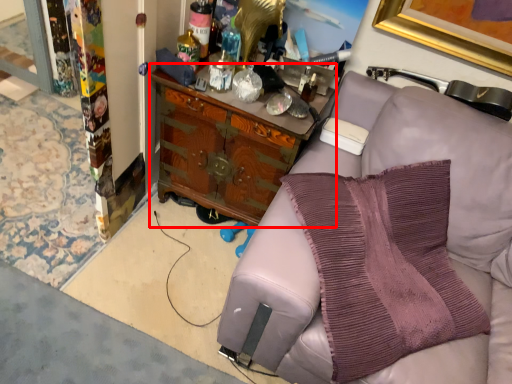
Question: Observing the image, what is the correct spatial positioning of cabinetry (annotated by the red box) in reference to pillow?

Choices:
 (A) left
 (B) right

Answer: (A)